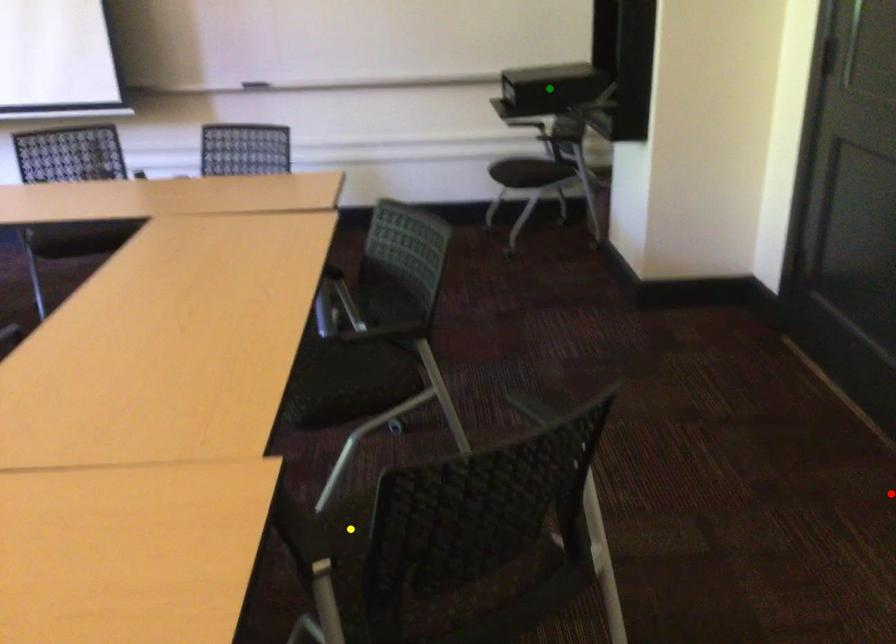
Order these from nearest to farthest:
1. red point
2. yellow point
3. green point

green point
red point
yellow point